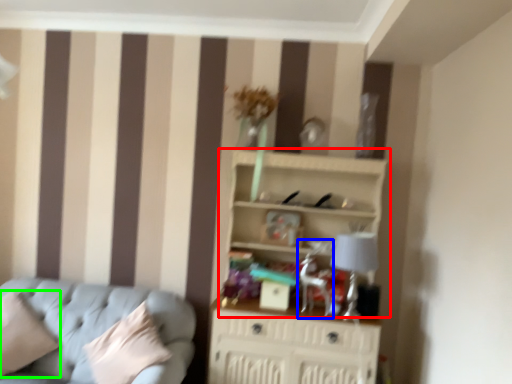
Question: Considering the real-world distances, which object is closest to shelf (highlighted by a red box)? swivel chair (highlighted by a blue box) or pillow (highlighted by a green box).

Choices:
 (A) swivel chair
 (B) pillow

Answer: (A)